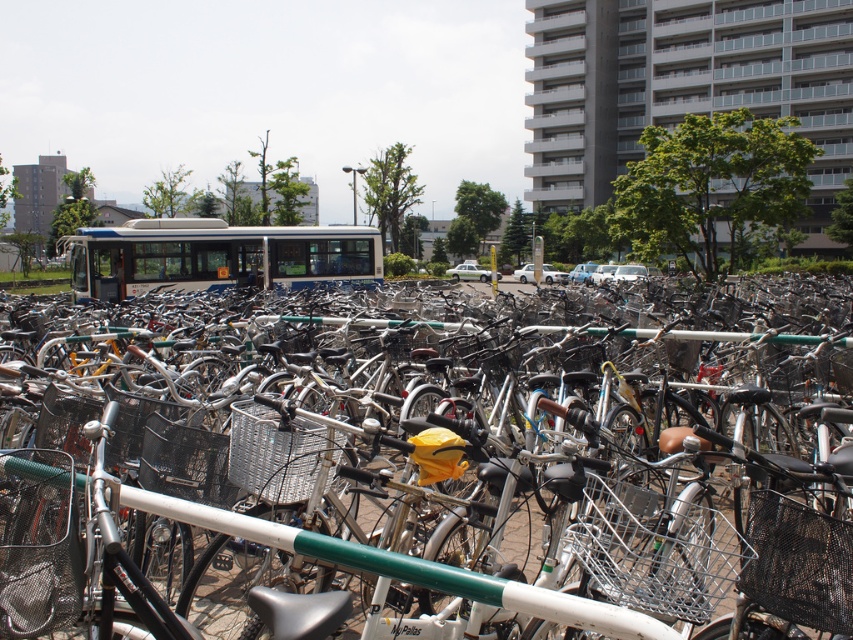
You are a delivery person trying to navigate through the bike parking area. You need to pass between the silver metallic bicycle at center and the white matte bus at center. Can you fit through the space between them if your delivery cart is 1 meter wide?

The silver metallic bicycle at center is thinner than the white matte bus at center, but the description does not provide specific measurements for the space between them. Without knowing the exact width of the gap, it is impossible to determine if the delivery cart can fit through.

Looking at this image, you are standing in the bike parking area and want to retrieve your silver metallic bicycle at center. Given that you can reach up to 10 feet, can you reach it without moving closer?

The silver metallic bicycle at center is 10.70 feet away from you, which is beyond your 10 feet reach. You need to move closer to reach it.

You are a pedestrian trying to cross the road and see the silver metallic bicycle at center and the white matte bus at center. Which one is closer to the road?

Answer: The silver metallic bicycle at center is closer to the road because it is located below the white matte bus at center, which is further away.